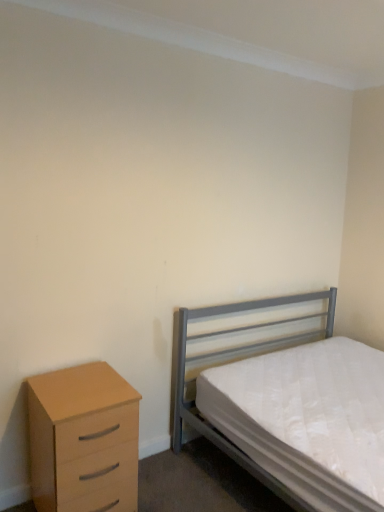
Find the location of a particular element. The image size is (384, 512). metallic gray bed at right is located at coordinates (236, 356).

Describe the element at coordinates (236, 356) in the screenshot. I see `metallic gray bed at right` at that location.

Measure the distance between light wood/veneer chest of drawers at left and camera.

A distance of 1.73 meters exists between light wood/veneer chest of drawers at left and camera.

Where is `light wood/veneer chest of drawers at left`? The width and height of the screenshot is (384, 512). light wood/veneer chest of drawers at left is located at coordinates (79, 432).

What do you see at coordinates (79, 432) in the screenshot? The height and width of the screenshot is (512, 384). I see `light wood/veneer chest of drawers at left` at bounding box center [79, 432].

What is the approximate width of light wood/veneer chest of drawers at left?

It is 18.91 inches.

Where is `metallic gray bed at right`? This screenshot has height=512, width=384. metallic gray bed at right is located at coordinates (236, 356).

In the scene shown: Considering the relative positions of light wood/veneer chest of drawers at left and metallic gray bed at right in the image provided, is light wood/veneer chest of drawers at left to the left or to the right of metallic gray bed at right?

Clearly, light wood/veneer chest of drawers at left is on the left of metallic gray bed at right in the image.

Between light wood/veneer chest of drawers at left and metallic gray bed at right, which one is positioned in front?

metallic gray bed at right.

Between point (86, 384) and point (276, 481), which one is positioned behind?

Positioned behind is point (86, 384).

From the image's perspective, which one is positioned lower, light wood/veneer chest of drawers at left or metallic gray bed at right?

light wood/veneer chest of drawers at left.

Based on the photo, from a real-world perspective, who is located higher, light wood/veneer chest of drawers at left or metallic gray bed at right?

In real-world perspective, metallic gray bed at right is above.

Looking at their sizes, would you say light wood/veneer chest of drawers at left is wider or thinner than metallic gray bed at right?

Considering their sizes, light wood/veneer chest of drawers at left looks slimmer than metallic gray bed at right.

Between light wood/veneer chest of drawers at left and metallic gray bed at right, which one has more height?

metallic gray bed at right.

Considering the relative sizes of light wood/veneer chest of drawers at left and metallic gray bed at right in the image provided, is light wood/veneer chest of drawers at left bigger than metallic gray bed at right?

Incorrect, light wood/veneer chest of drawers at left is not larger than metallic gray bed at right.

Can we say light wood/veneer chest of drawers at left lies outside metallic gray bed at right?

Yes, light wood/veneer chest of drawers at left is outside of metallic gray bed at right.

Is light wood/veneer chest of drawers at left directly adjacent to metallic gray bed at right?

No, light wood/veneer chest of drawers at left is not making contact with metallic gray bed at right.

Could you tell me if light wood/veneer chest of drawers at left is facing metallic gray bed at right?

No, light wood/veneer chest of drawers at left is not oriented towards metallic gray bed at right.

How different are the orientations of light wood/veneer chest of drawers at left and metallic gray bed at right in degrees?

1.87 degrees.

The height and width of the screenshot is (512, 384). Identify the location of bed to the right of light wood/veneer chest of drawers at left. (236, 356).

Which object is positioned more to the left, metallic gray bed at right or light wood/veneer chest of drawers at left?

From the viewer's perspective, light wood/veneer chest of drawers at left appears more on the left side.

Does metallic gray bed at right lie in front of light wood/veneer chest of drawers at left?

Yes, it is in front of light wood/veneer chest of drawers at left.

Is point (314, 315) closer or farther from the camera than point (131, 422)?

Point (314, 315) appears to be farther away from the viewer than point (131, 422).

From the image's perspective, relative to light wood/veneer chest of drawers at left, is metallic gray bed at right above or below?

metallic gray bed at right is above light wood/veneer chest of drawers at left.

From a real-world perspective, relative to light wood/veneer chest of drawers at left, is metallic gray bed at right vertically above or below?

In terms of real-world spatial position, metallic gray bed at right is above light wood/veneer chest of drawers at left.

Which object is wider, metallic gray bed at right or light wood/veneer chest of drawers at left?

metallic gray bed at right.

Does metallic gray bed at right have a lesser height compared to light wood/veneer chest of drawers at left?

Incorrect, the height of metallic gray bed at right does not fall short of that of light wood/veneer chest of drawers at left.

Which of these two, metallic gray bed at right or light wood/veneer chest of drawers at left, is smaller?

light wood/veneer chest of drawers at left is smaller.

Which is correct: metallic gray bed at right is inside light wood/veneer chest of drawers at left, or outside of it?

metallic gray bed at right is located beyond the bounds of light wood/veneer chest of drawers at left.

Is metallic gray bed at right far from light wood/veneer chest of drawers at left?

They are positioned close to each other.

Is metallic gray bed at right positioned with its back to light wood/veneer chest of drawers at left?

That's not correct — metallic gray bed at right is not looking away from light wood/veneer chest of drawers at left.

How different are the orientations of metallic gray bed at right and light wood/veneer chest of drawers at left in degrees?

The angular difference between metallic gray bed at right and light wood/veneer chest of drawers at left is 1.87 degrees.

Where is `the chest of drawers lying below the metallic gray bed at right (from the image's perspective)`? the chest of drawers lying below the metallic gray bed at right (from the image's perspective) is located at coordinates click(79, 432).

The height and width of the screenshot is (512, 384). I want to click on chest of drawers behind the metallic gray bed at right, so click(79, 432).

Identify the location of bed located on the right of light wood/veneer chest of drawers at left. Image resolution: width=384 pixels, height=512 pixels. (236, 356).